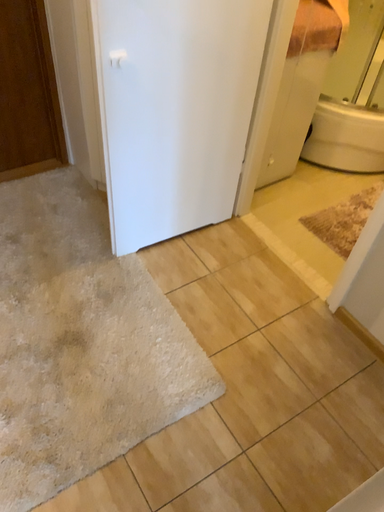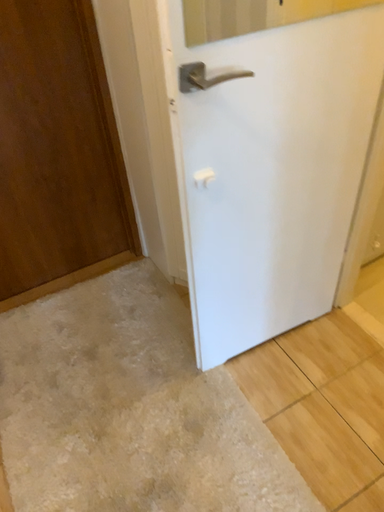
Question: How did the camera likely rotate when shooting the video?

Choices:
 (A) rotated left
 (B) rotated right

Answer: (A)